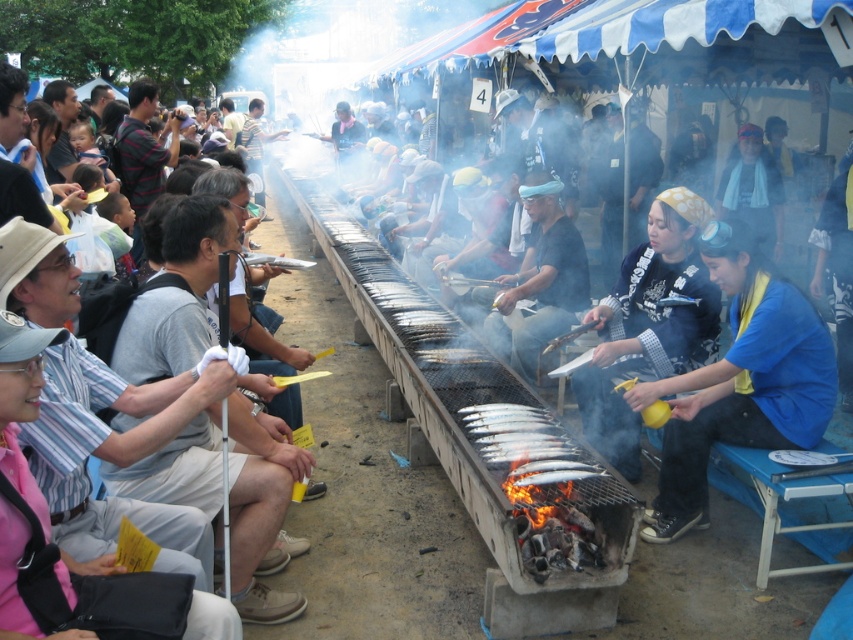
Question: Which of the following is the closest to the observer?

Choices:
 (A) silver metallic fish at center
 (B) matte gray shirt at left
 (C) blue fabric shirt at lower right

Answer: (B)

Question: Which of the following is the closest to the observer?

Choices:
 (A) silver metallic fish at center
 (B) blue fabric shirt at lower right
 (C) matte gray shirt at left

Answer: (C)

Question: Does blue fabric shirt at lower right appear under silver metallic fish at center?

Choices:
 (A) no
 (B) yes

Answer: (A)

Question: Is matte gray shirt at left further to camera compared to silver metallic fish at center?

Choices:
 (A) yes
 (B) no

Answer: (B)

Question: Does blue fabric shirt at lower right have a lesser width compared to matte gray shirt at left?

Choices:
 (A) yes
 (B) no

Answer: (B)

Question: Which point is closer to the camera taking this photo?

Choices:
 (A) (273, 445)
 (B) (566, 476)
 (C) (744, 424)

Answer: (A)